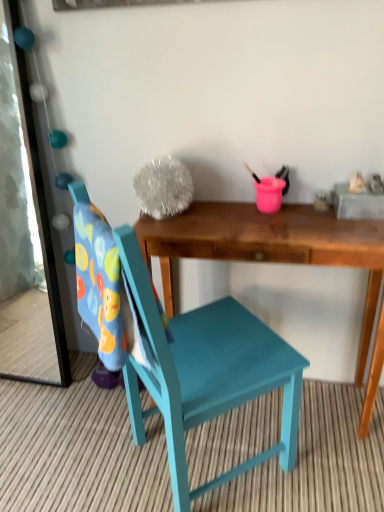
Image resolution: width=384 pixels, height=512 pixels. Find the location of `blank space to the left of wooden desk at center`. blank space to the left of wooden desk at center is located at coordinates (78, 431).